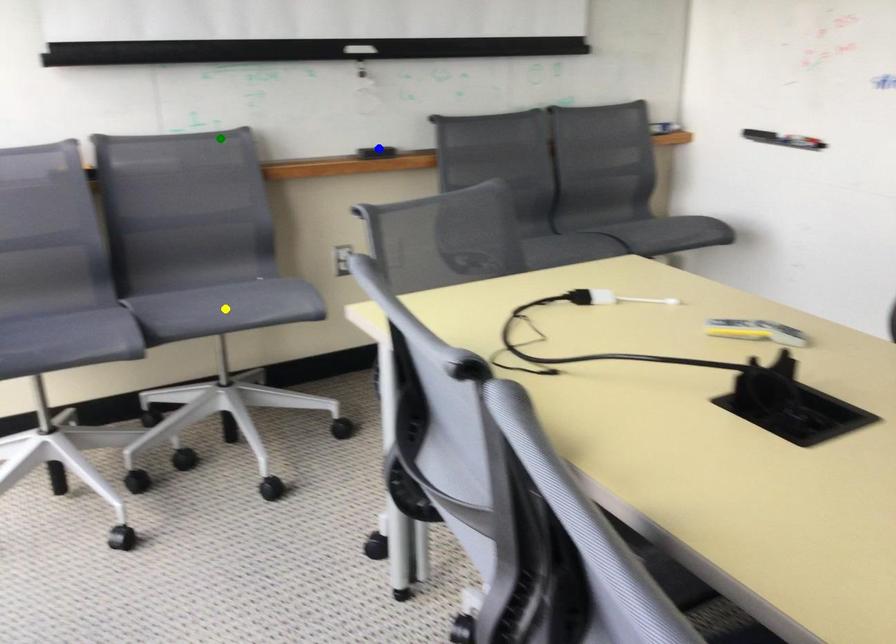
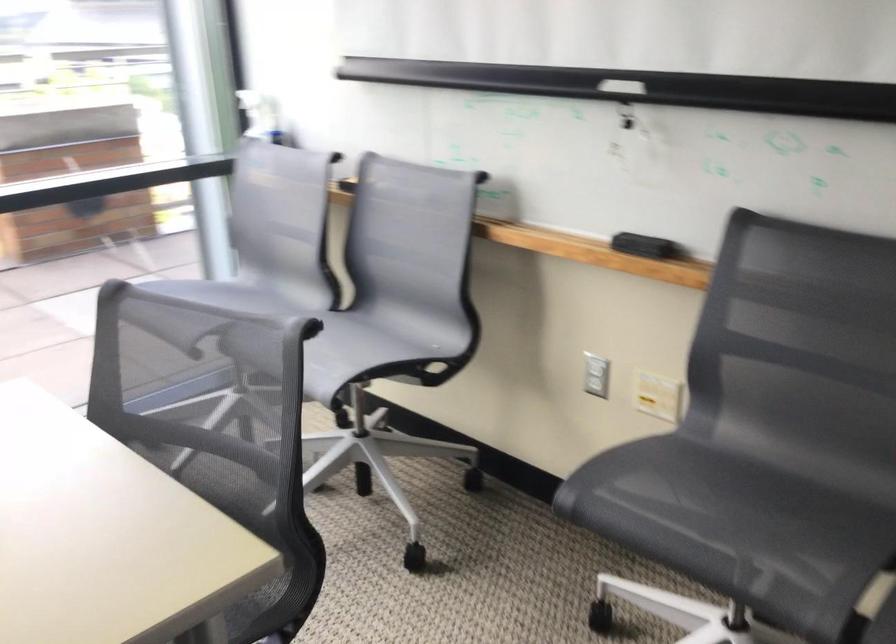
I am providing you with two images of the same scene from different viewpoints. Three points are marked in image1. Which point corresponds to a part or object that is occluded in image2?In image1, three points are marked. Which of them correspond to a part or object that is occluded in image2?Among the three points shown in image1, which one corresponds to a part or object that is no longer visible due to occlusion in image2?

yellow point